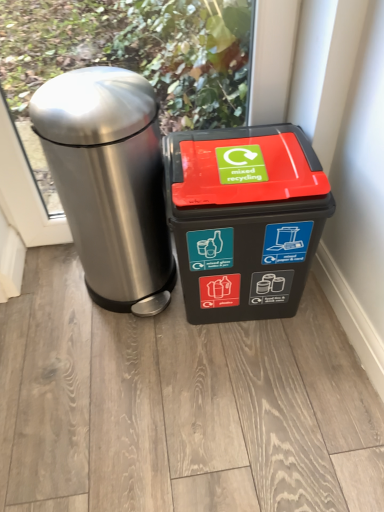
Question: Can you confirm if black plastic recycling bin at center, which is the 2th waste container from left to right, is positioned to the left of polished stainless steel trash can at left, arranged as the second waste container when viewed from the right?

Choices:
 (A) yes
 (B) no

Answer: (B)

Question: From the image's perspective, is black plastic recycling bin at center, which is the 1th waste container from right to left, above polished stainless steel trash can at left, arranged as the second waste container when viewed from the right?

Choices:
 (A) no
 (B) yes

Answer: (A)

Question: Is black plastic recycling bin at center, which is the 1th waste container from right to left, shorter than polished stainless steel trash can at left, arranged as the 1th waste container when viewed from the left?

Choices:
 (A) yes
 (B) no

Answer: (A)

Question: Is the position of black plastic recycling bin at center, which is the 2th waste container from left to right, more distant than that of polished stainless steel trash can at left, arranged as the 1th waste container when viewed from the left?

Choices:
 (A) no
 (B) yes

Answer: (B)

Question: Could polished stainless steel trash can at left, arranged as the 1th waste container when viewed from the left, be considered to be inside black plastic recycling bin at center, which is the 2th waste container from left to right?

Choices:
 (A) no
 (B) yes

Answer: (A)

Question: Is black plastic recycling bin at center, which is the 1th waste container from right to left, to the right of polished stainless steel trash can at left, arranged as the 1th waste container when viewed from the left, from the viewer's perspective?

Choices:
 (A) no
 (B) yes

Answer: (B)

Question: Could you tell me if polished stainless steel trash can at left, arranged as the second waste container when viewed from the right, is turned towards black plastic recycling bin at center, which is the 1th waste container from right to left?

Choices:
 (A) yes
 (B) no

Answer: (B)

Question: Considering the relative sizes of polished stainless steel trash can at left, arranged as the second waste container when viewed from the right, and black plastic recycling bin at center, which is the 1th waste container from right to left, in the image provided, is polished stainless steel trash can at left, arranged as the second waste container when viewed from the right, thinner than black plastic recycling bin at center, which is the 1th waste container from right to left,?

Choices:
 (A) no
 (B) yes

Answer: (A)

Question: Can you see polished stainless steel trash can at left, arranged as the 1th waste container when viewed from the left, touching black plastic recycling bin at center, which is the 1th waste container from right to left?

Choices:
 (A) yes
 (B) no

Answer: (B)

Question: Is polished stainless steel trash can at left, arranged as the 1th waste container when viewed from the left, wider than black plastic recycling bin at center, which is the 2th waste container from left to right?

Choices:
 (A) no
 (B) yes

Answer: (B)

Question: Considering the relative positions of polished stainless steel trash can at left, arranged as the 1th waste container when viewed from the left, and black plastic recycling bin at center, which is the 1th waste container from right to left, in the image provided, is polished stainless steel trash can at left, arranged as the 1th waste container when viewed from the left, behind black plastic recycling bin at center, which is the 1th waste container from right to left,?

Choices:
 (A) no
 (B) yes

Answer: (A)

Question: Is black plastic recycling bin at center, which is the 2th waste container from left to right, at the back of polished stainless steel trash can at left, arranged as the second waste container when viewed from the right?

Choices:
 (A) yes
 (B) no

Answer: (B)

Question: In the image, is black plastic recycling bin at center, which is the 1th waste container from right to left, positioned in front of or behind polished stainless steel trash can at left, arranged as the second waste container when viewed from the right?

Choices:
 (A) front
 (B) behind

Answer: (B)